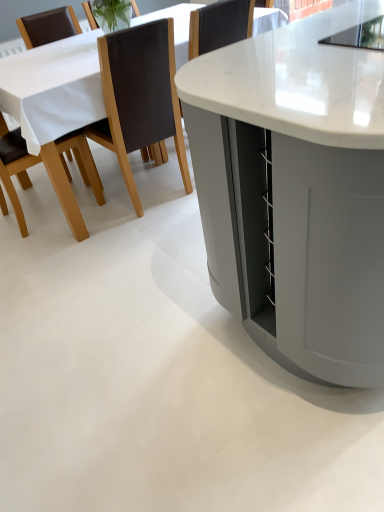
Question: Does white marble table at center, placed as the second table when sorted from back to front, have a greater width compared to brown leather chair at upper left, which is the 1th chair from right to left?

Choices:
 (A) no
 (B) yes

Answer: (B)

Question: From a real-world perspective, is white marble table at center, positioned as the first table in front-to-back order, located higher than brown leather chair at upper left, which is the 1th chair from right to left?

Choices:
 (A) yes
 (B) no

Answer: (A)

Question: Does white marble table at center, placed as the second table when sorted from back to front, have a smaller size compared to brown leather chair at upper left, the 2th chair positioned from the left?

Choices:
 (A) yes
 (B) no

Answer: (B)

Question: Is white marble table at center, placed as the second table when sorted from back to front, positioned in front of brown leather chair at upper left, which is the 1th chair from right to left?

Choices:
 (A) no
 (B) yes

Answer: (B)

Question: From the image's perspective, is white marble table at center, placed as the second table when sorted from back to front, above brown leather chair at upper left, which is the 1th chair from right to left?

Choices:
 (A) no
 (B) yes

Answer: (A)

Question: Looking at the image, does brown leather chair at upper left, which is the 1th chair from right to left, seem bigger or smaller compared to white marble table at center, positioned as the first table in front-to-back order?

Choices:
 (A) small
 (B) big

Answer: (A)

Question: Based on their positions, is brown leather chair at upper left, which is the 1th chair from right to left, located to the left or right of white marble table at center, positioned as the first table in front-to-back order?

Choices:
 (A) right
 (B) left

Answer: (B)

Question: From the image's perspective, is brown leather chair at upper left, the 2th chair positioned from the left, positioned above or below white marble table at center, positioned as the first table in front-to-back order?

Choices:
 (A) above
 (B) below

Answer: (A)

Question: Looking at their shapes, would you say brown leather chair at upper left, the 2th chair positioned from the left, is wider or thinner than white marble table at center, positioned as the first table in front-to-back order?

Choices:
 (A) thin
 (B) wide

Answer: (A)

Question: From the image's perspective, is white marble table at center, the 2th table from the front, located above or below white marble table at center, positioned as the first table in front-to-back order?

Choices:
 (A) below
 (B) above

Answer: (B)

Question: From a real-world perspective, is white marble table at center, the 1th table viewed from the back, above or below white marble table at center, placed as the second table when sorted from back to front?

Choices:
 (A) above
 (B) below

Answer: (B)

Question: Considering their positions, is white marble table at center, the 2th table from the front, located in front of or behind white marble table at center, positioned as the first table in front-to-back order?

Choices:
 (A) front
 (B) behind

Answer: (B)

Question: Is white marble table at center, the 1th table viewed from the back, wider or thinner than white marble table at center, placed as the second table when sorted from back to front?

Choices:
 (A) thin
 (B) wide

Answer: (B)

Question: In terms of height, does brown leather chair at left, the 1th chair viewed from the left, look taller or shorter compared to brown leather chair at upper left, the 2th chair positioned from the left?

Choices:
 (A) tall
 (B) short

Answer: (B)

Question: In terms of width, does brown leather chair at left, the 1th chair viewed from the left, look wider or thinner when compared to brown leather chair at upper left, which is the 1th chair from right to left?

Choices:
 (A) wide
 (B) thin

Answer: (A)